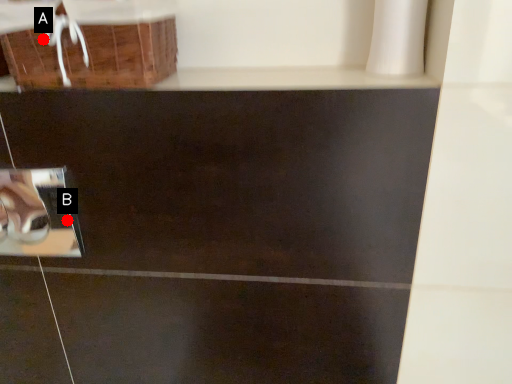
Question: Two points are circled on the image, labeled by A and B beside each circle. Which point is farther from the camera taking this photo?

Choices:
 (A) A is further
 (B) B is further

Answer: (B)